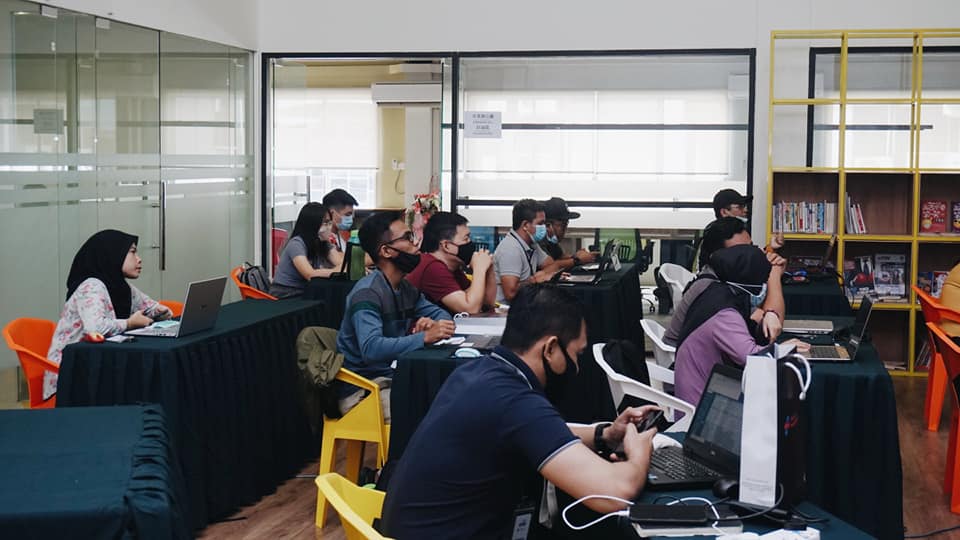
The width and height of the screenshot is (960, 540). What are the coordinates of `floor` in the screenshot? It's located at (276, 506).